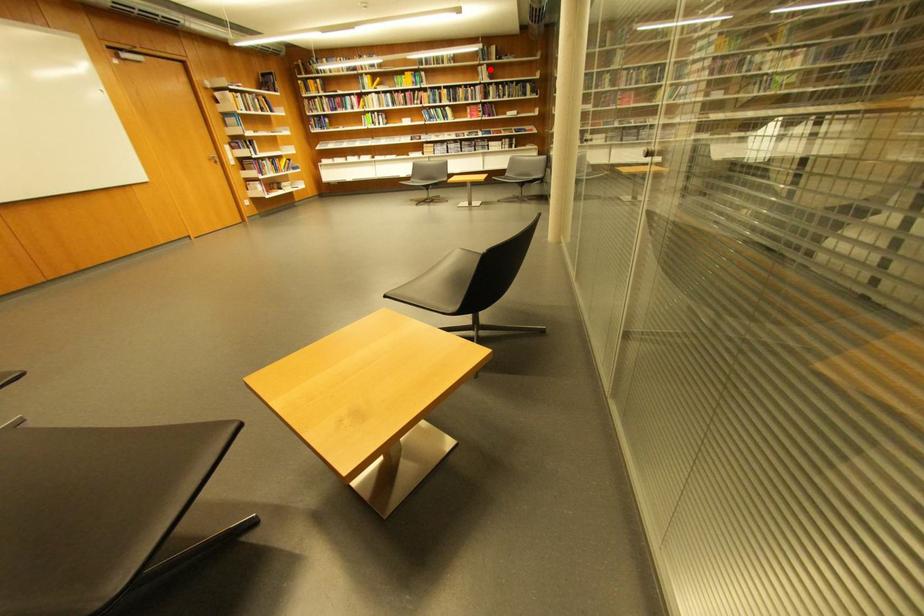
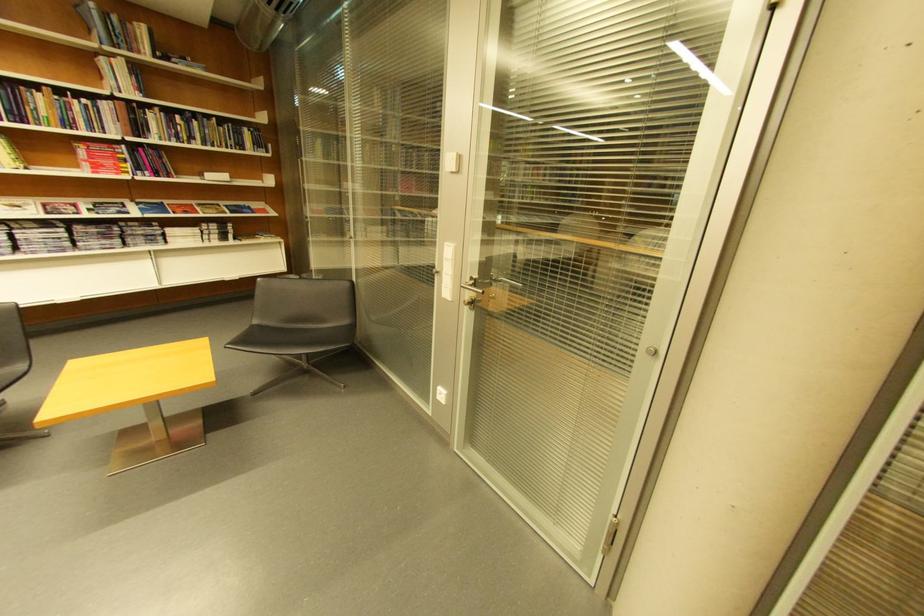
Question: A red point is marked in image1. In image2, is the corresponding 3D point closer to the camera or farther? Reply with the corresponding letter.

Choices:
 (A) The corresponding 3D point is closer.
 (B) The corresponding 3D point is farther.

Answer: (B)